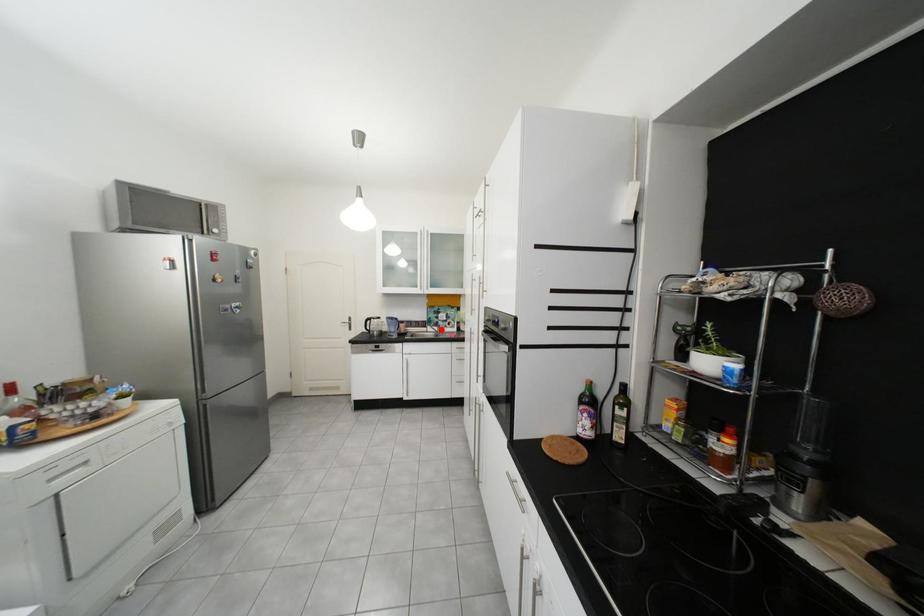
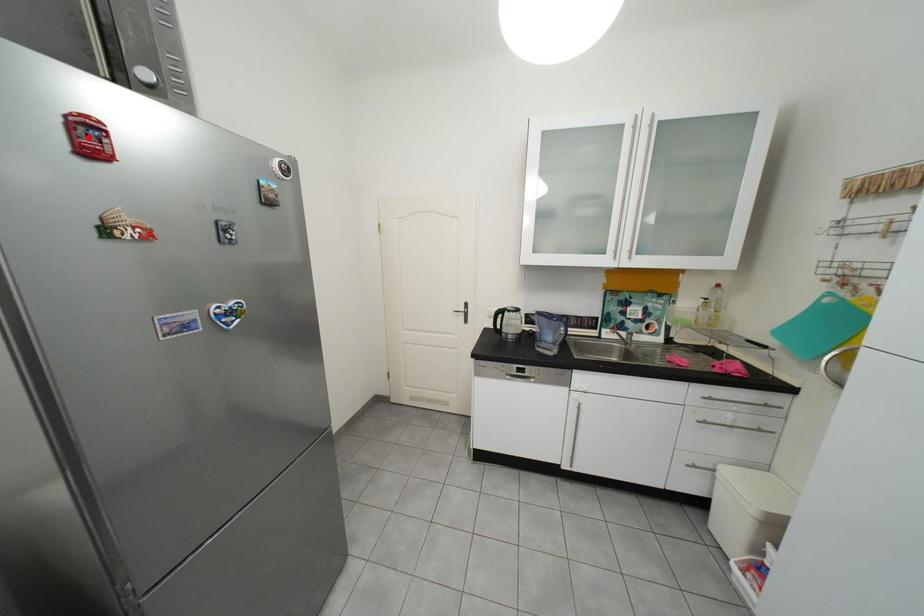
I am providing you with two images of the same scene from different viewpoints. A red point is marked on the first image and another point is marked on the second image. Are the points marked in image1 and image2 representing the same 3D position?

No